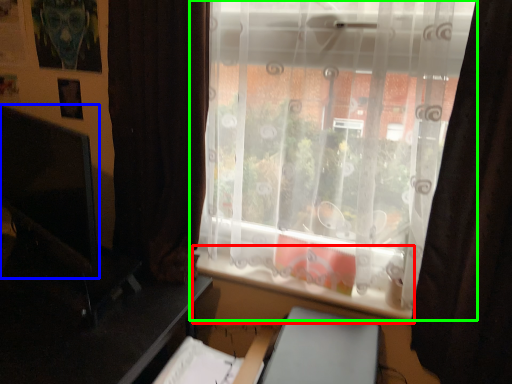
Question: Estimate the real-world distances between objects in this image. Which object is closer to window sill (highlighted by a red box), computer monitor (highlighted by a blue box) or window (highlighted by a green box)?

Choices:
 (A) computer monitor
 (B) window

Answer: (B)